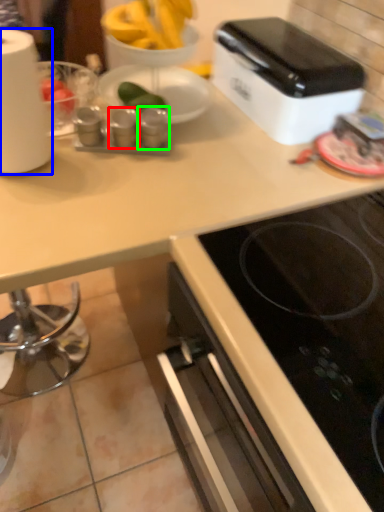
Question: Which is nearer to the appliance (highlighted by a red box)? paper towel (highlighted by a blue box) or appliance (highlighted by a green box).

Choices:
 (A) paper towel
 (B) appliance

Answer: (B)